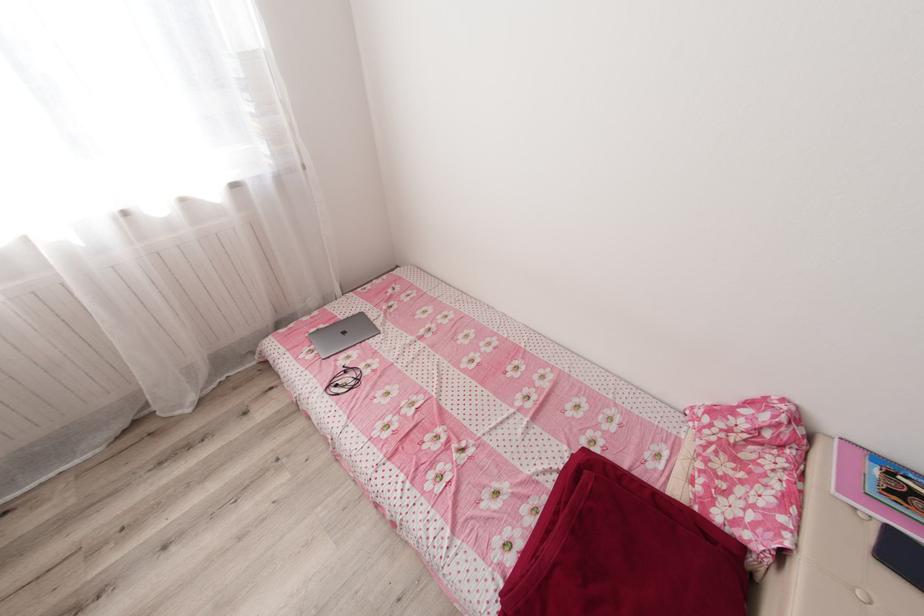
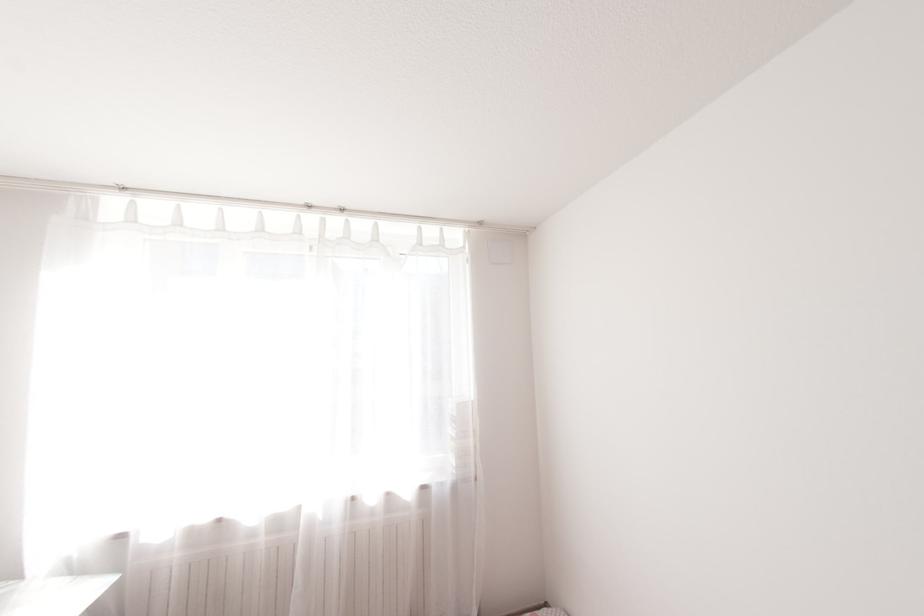
First-person continuous shooting, in which direction is the camera rotating?

The camera's rotation is toward left-up.